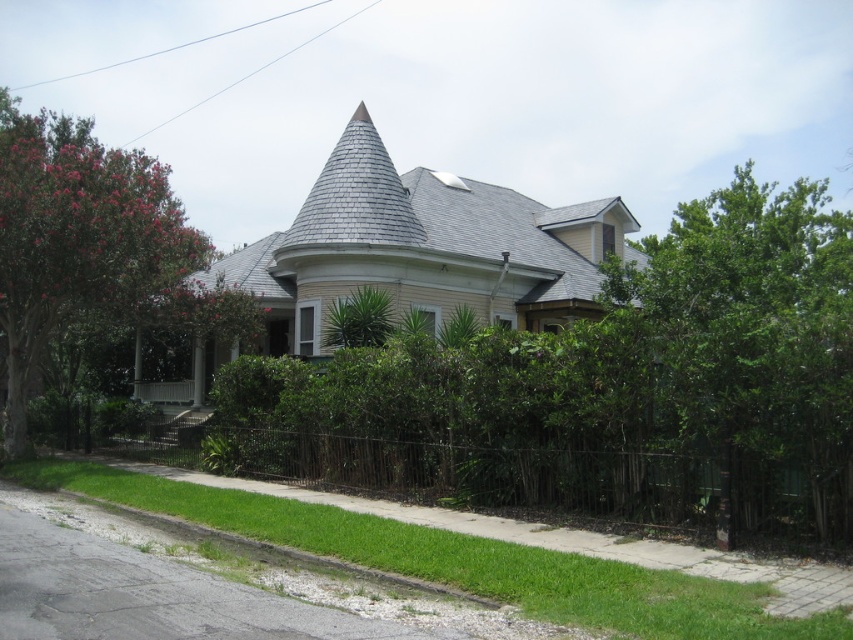
You are a landscape designer planning to add a new garden feature between the green leafy tree at right and the black wrought iron fence at lower center. Considering their sizes, which object should you place closer to the smaller one to maintain balance?

The black wrought iron fence at lower center is smaller in size than the green leafy tree at right. To maintain balance, place the garden feature closer to the black wrought iron fence at lower center so it visually complements the smaller object.

You are standing in front of the house and notice a black wrought iron fence at lower center and a green leafy tree at left. Which object is positioned to the right of the other?

The black wrought iron fence at lower center is to the right of the green leafy tree at left.

You are standing in front of the house and want to walk to the green leafy bush at center. Which direction should you turn from the black wrought iron fence at lower center to face the bush?

The green leafy bush at center is to the right of the black wrought iron fence at lower center, so you should turn right to face the bush.